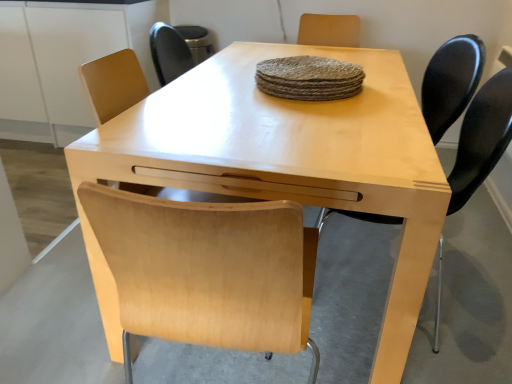
Question: Is matte black chair at right, the first chair when ordered from back to front, inside or outside of light wood table at center?

Choices:
 (A) outside
 (B) inside

Answer: (A)

Question: Relative to light wood table at center, is matte black chair at right, the first chair when ordered from back to front, in front or behind?

Choices:
 (A) behind
 (B) front

Answer: (A)

Question: Based on their relative distances, which object is farther from the matte black chair at right, the 2th chair viewed from the front?

Choices:
 (A) light wood table at center
 (B) matte black chair at right, positioned as the 2th chair in back-to-front order
 (C) light wood table at center

Answer: (A)

Question: Which is nearer to the light wood table at center?

Choices:
 (A) matte black chair at right, the 2th chair viewed from the front
 (B) matte black chair at right, positioned as the 2th chair in back-to-front order
 (C) light wood table at center

Answer: (B)